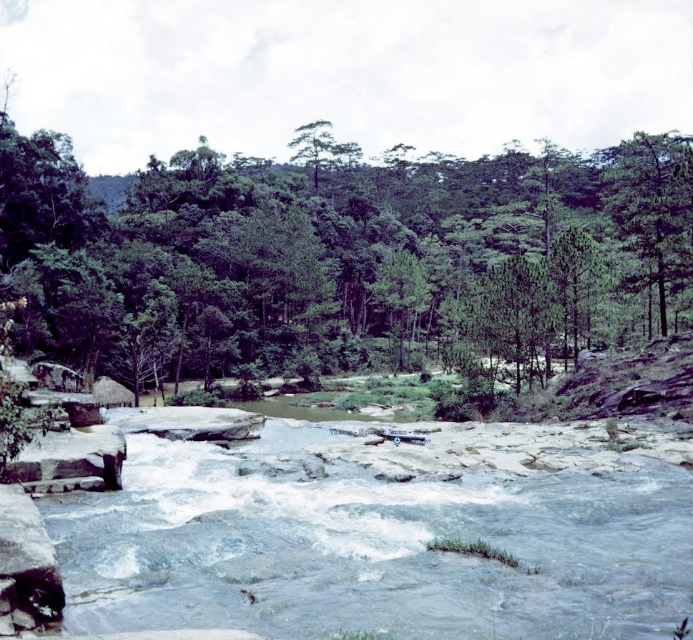
Does green leafy forest at center have a greater width compared to green matte tree at center?

Indeed, green leafy forest at center has a greater width compared to green matte tree at center.

Who is taller, green leafy forest at center or green matte tree at center?

green leafy forest at center is taller.

Which is in front, point (337, 234) or point (426, 305)?

Point (426, 305)

You are a GUI agent. You are given a task and a screenshot of the screen. Output one action in this format:
    pyautogui.click(x=<x>, y=<y>)
    Task: Click on the green leafy forest at center
    The height and width of the screenshot is (640, 693).
    Given the screenshot: What is the action you would take?
    pyautogui.click(x=340, y=259)

Can you confirm if green leafy forest at center is smaller than clear water at center?

No.

In the scene shown: Is green leafy forest at center further to the viewer compared to clear water at center?

Yes, green leafy forest at center is further from the viewer.

Who is more distant from viewer, (622, 148) or (578, 625)?

Point (622, 148)

Find the location of a particular element. This screenshot has height=640, width=693. green leafy forest at center is located at coordinates (340, 259).

Is clear water at center further to the viewer compared to green matte tree at center?

No, clear water at center is in front of green matte tree at center.

At what (x,y) coordinates should I click in order to perform the action: click on clear water at center. Please return your answer as a coordinate pair (x, y). Image resolution: width=693 pixels, height=640 pixels. Looking at the image, I should click on (385, 536).